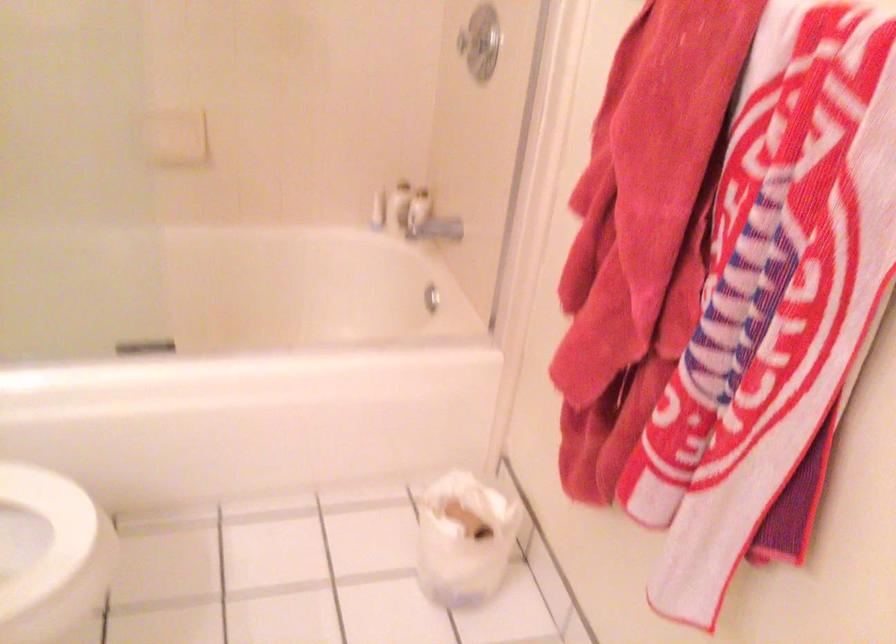
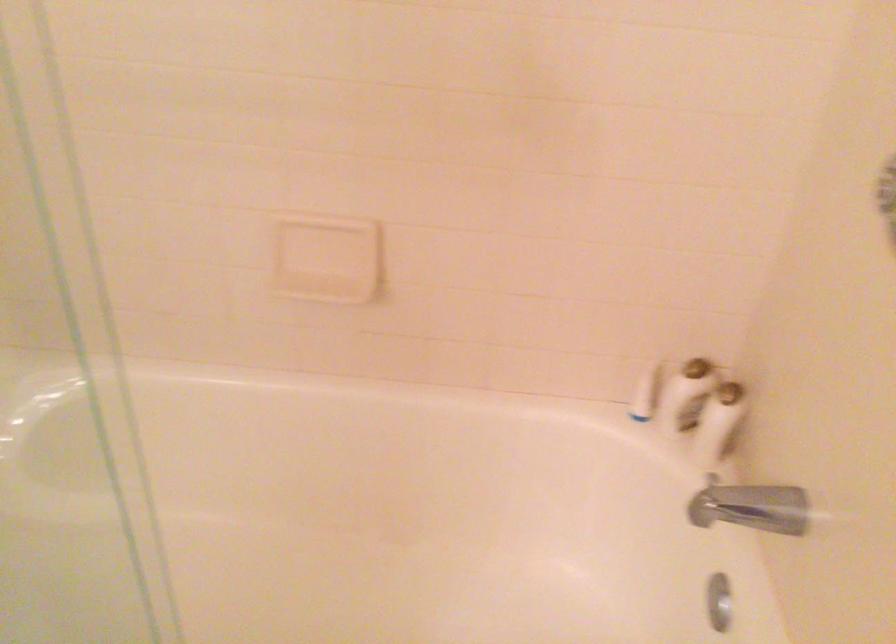
Locate, in the second image, the point that corresponds to the point at 442,225 in the first image.

(757, 507)